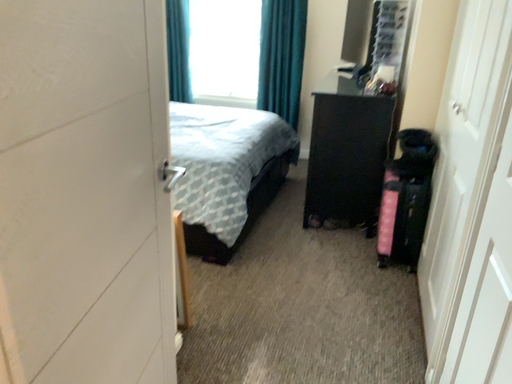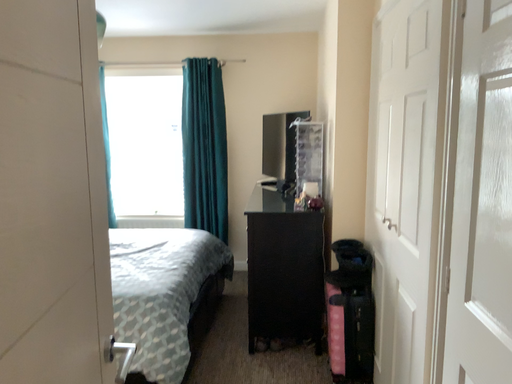
Question: How did the camera likely rotate when shooting the video?

Choices:
 (A) rotated right
 (B) rotated left

Answer: (A)